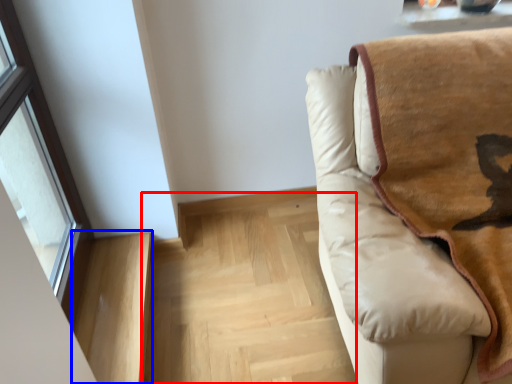
Question: Among these objects, which one is farthest to the camera, stairwell (highlighted by a red box) or stairwell (highlighted by a blue box)?

Choices:
 (A) stairwell
 (B) stairwell

Answer: (A)